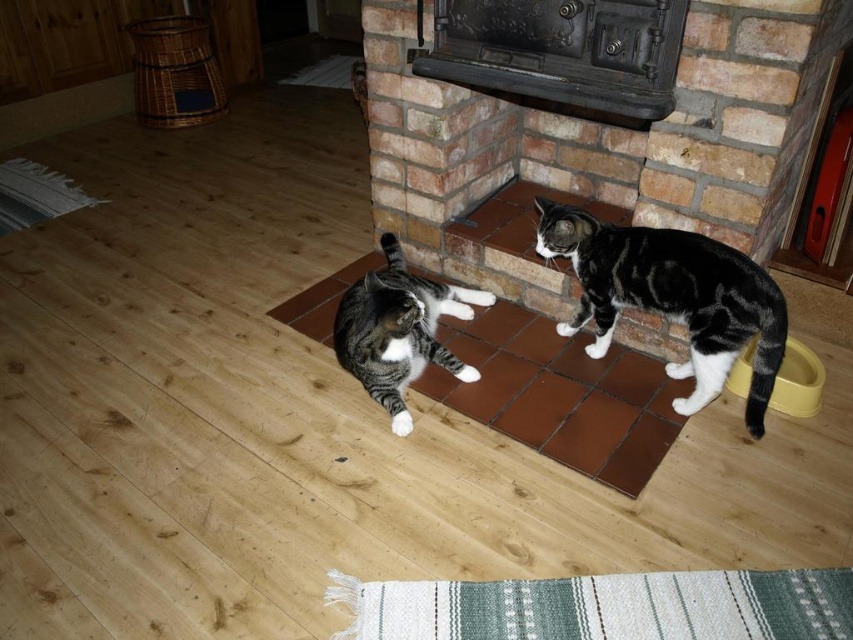
Question: Is tabby fur cat at right smaller than gray striped cat at center?

Choices:
 (A) yes
 (B) no

Answer: (B)

Question: Estimate the real-world distances between objects in this image. Which object is closer to the tabby fur cat at right?

Choices:
 (A) green woven mat at lower center
 (B) gray striped cat at center
 (C) brown tile mat at center
 (D) black metal fireplace at center

Answer: (C)

Question: Which object is farther from the camera taking this photo?

Choices:
 (A) green woven mat at lower center
 (B) brown tile mat at center
 (C) tabby fur cat at right

Answer: (B)

Question: Is green woven mat at lower center above tabby fur cat at right?

Choices:
 (A) no
 (B) yes

Answer: (A)

Question: Which object appears farthest from the camera in this image?

Choices:
 (A) gray striped cat at center
 (B) tabby fur cat at right

Answer: (A)

Question: Is green woven mat at lower center positioned before gray striped cat at center?

Choices:
 (A) no
 (B) yes

Answer: (B)